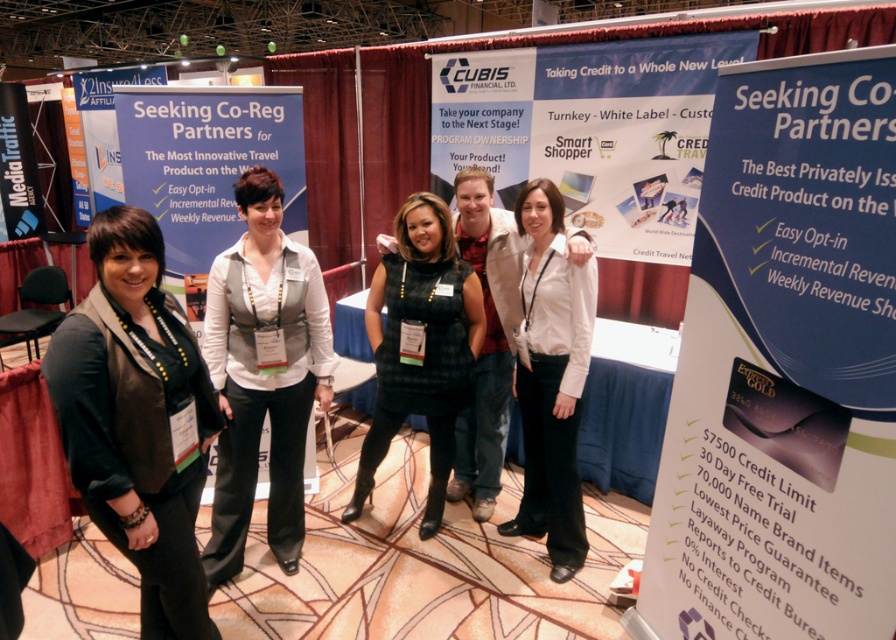
You are a photographer at the event and need to capture a photo where the matte brown vest at left and the black plaid dress at center are both visible. Based on their heights, which one might appear more in the foreground?

The matte brown vest at left is not as tall as the black plaid dress at center, so the shorter matte brown vest at left would likely appear in the foreground if positioned closer to the camera, but height alone doesn

You are a photographer at the event and need to capture a photo of the black plaid dress at center and the white matte shirt at center. Based on their positions, which one is lower in the image?

The black plaid dress at center is positioned under the white matte shirt at center, so the black plaid dress at center is lower in the image.

You are a photographer at the event and need to ensure that both the matte brown vest at left and the white textured vest at center are clearly visible in your photo. Which vest should you focus on first to ensure it doesn t get cropped out?

The matte brown vest at left is smaller than the white textured vest at center, so you should focus on ensuring the smaller matte brown vest at left is fully visible first to prevent it from being cropped out.